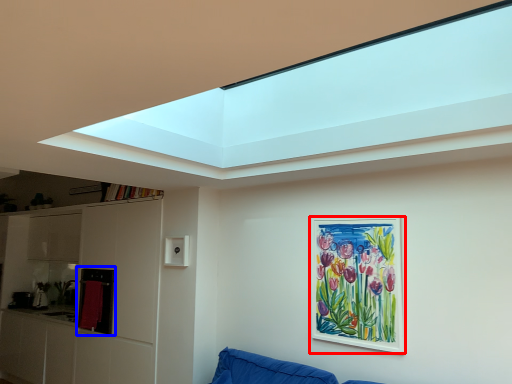
Question: Which object is further to the camera taking this photo, picture frame (highlighted by a red box) or cabinet (highlighted by a blue box)?

Choices:
 (A) picture frame
 (B) cabinet

Answer: (B)